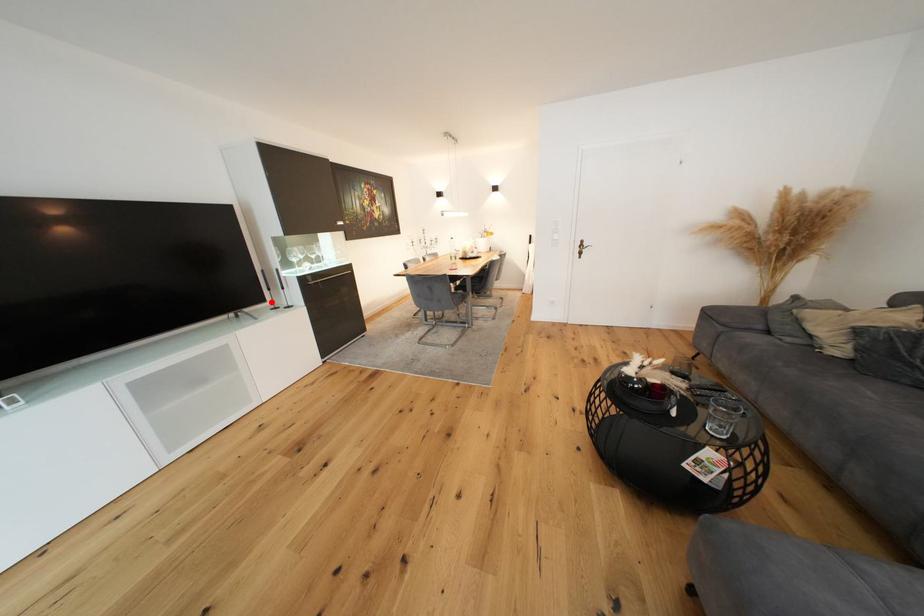
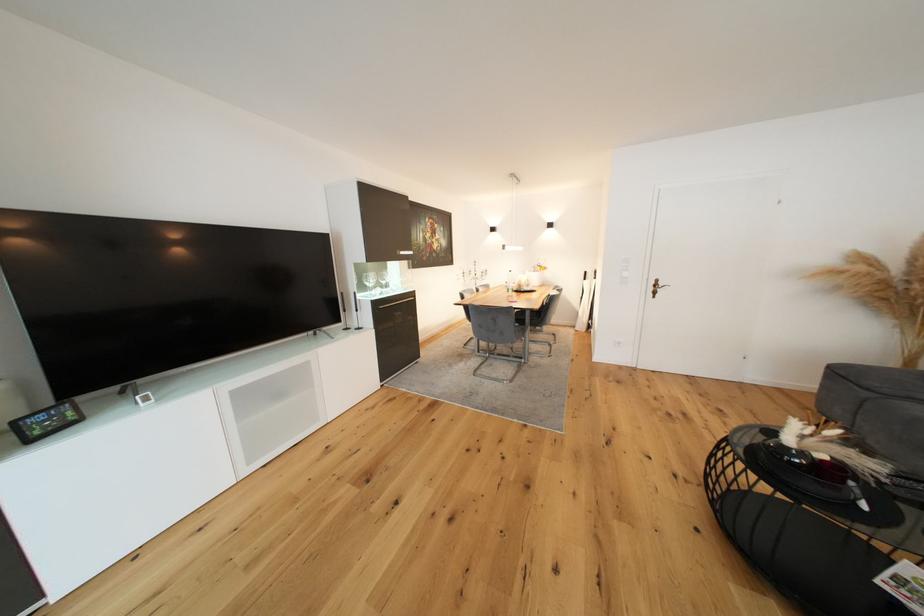
Question: I am providing you with two images of the same scene from different viewpoints. In image1, a red point is highlighted. Considering the same 3D point in image2, which of the following is correct?

Choices:
 (A) It is closer
 (B) It is farther

Answer: (B)